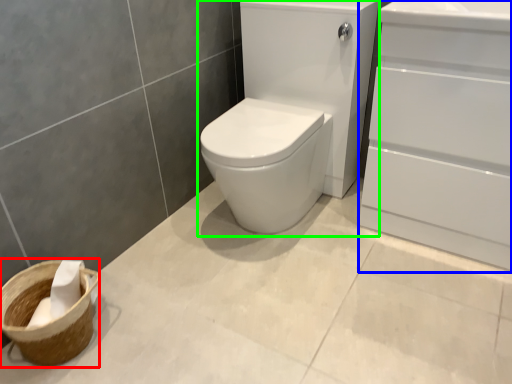
Question: Which object is the farthest from basket container (highlighted by a red box)? Choose among these: screen door (highlighted by a blue box) or sink (highlighted by a green box).

Choices:
 (A) screen door
 (B) sink

Answer: (A)